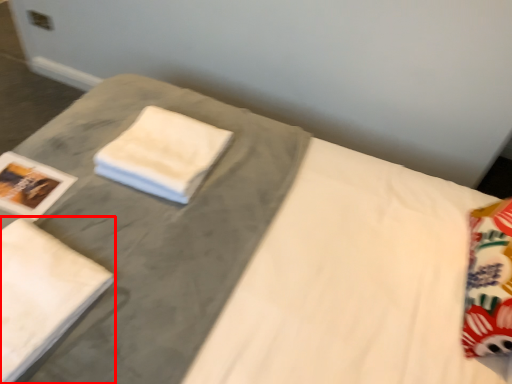
Question: From the image, what is the correct spatial relationship of bath towel (annotated by the red box) in relation to cloth?

Choices:
 (A) left
 (B) right

Answer: (A)